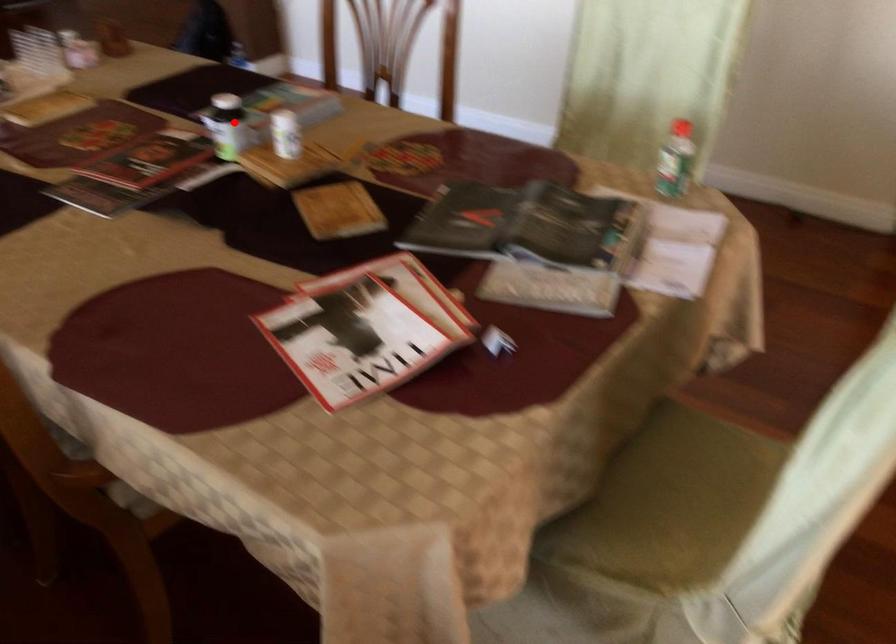
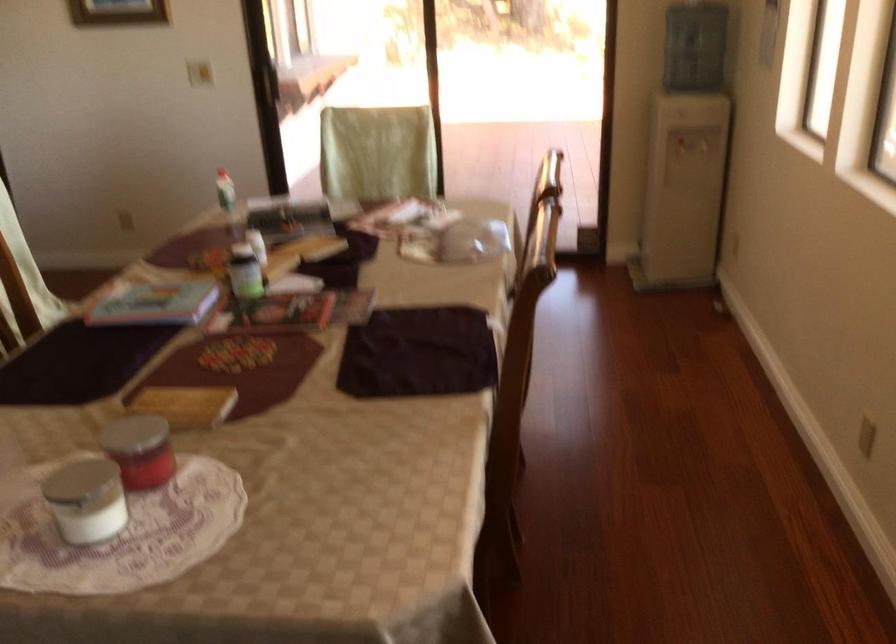
Question: I am providing you with two images of the same scene from different viewpoints. In image1, a red point is highlighted. Considering the same 3D point in image2, which of the following is correct?

Choices:
 (A) It is closer
 (B) It is farther

Answer: (B)